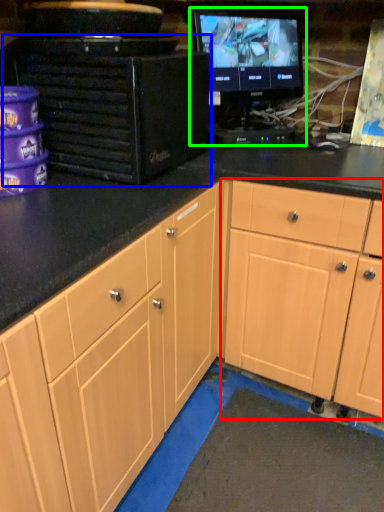
Question: Which object is the closest to the cabinetry (highlighted by a red box)? Choose among these: desktop computer (highlighted by a blue box) or computer monitor (highlighted by a green box).

Choices:
 (A) desktop computer
 (B) computer monitor

Answer: (A)